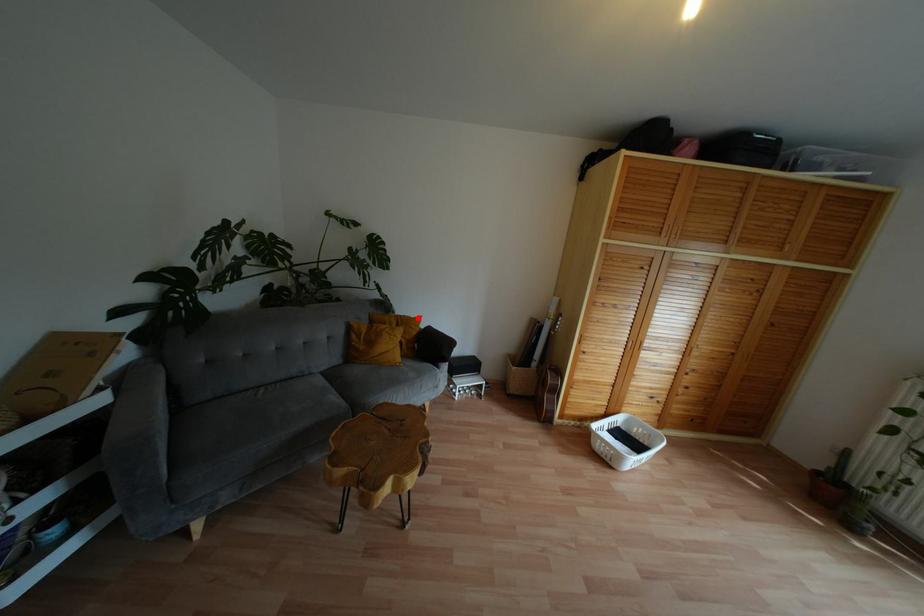
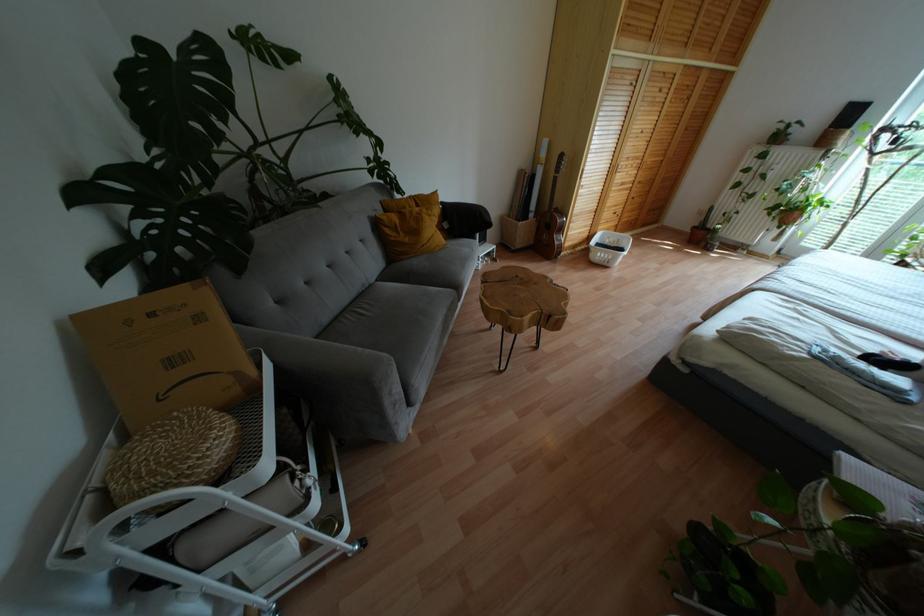
Question: I am providing you with two images of the same scene from different viewpoints. Image1 has a red point marked. In image2, the corresponding 3D location appears at what relative position? Reply with the corresponding letter.

Choices:
 (A) Closer
 (B) Farther

Answer: (A)